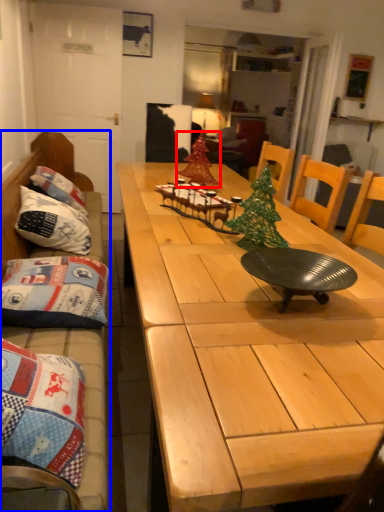
Question: Which point is further to the camera, christmas tree (highlighted by a red box) or studio couch (highlighted by a blue box)?

Choices:
 (A) christmas tree
 (B) studio couch

Answer: (A)